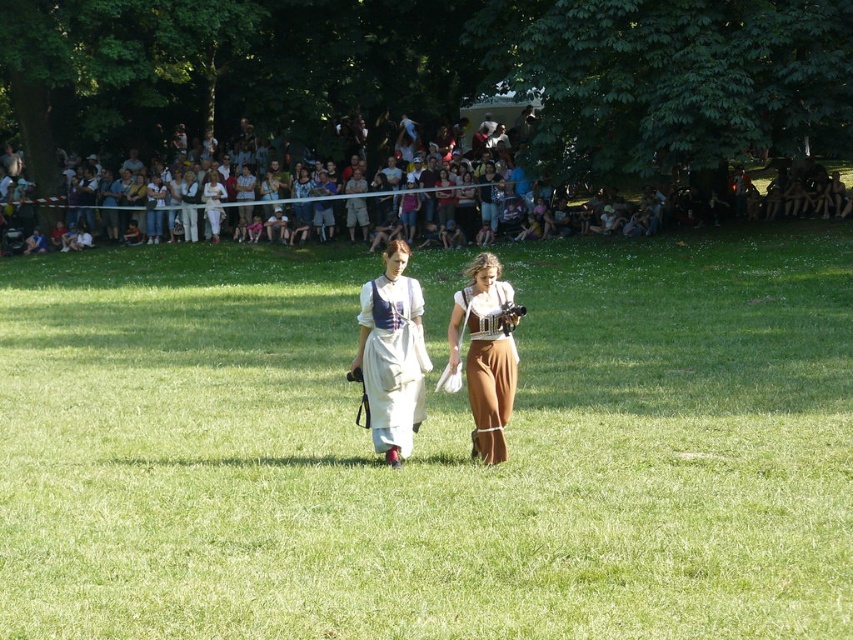
Question: Does white casual clothing at upper center appear over matte white dress at center?

Choices:
 (A) no
 (B) yes

Answer: (B)

Question: Which point appears farthest from the camera in this image?

Choices:
 (A) (482, 396)
 (B) (683, 349)
 (C) (399, 284)

Answer: (B)

Question: Estimate the real-world distances between objects in this image. Which object is farther from the brown leather pants at center?

Choices:
 (A) green grass at center
 (B) white casual clothing at upper center
 (C) matte white dress at center

Answer: (B)

Question: Can you confirm if green grass at center is positioned to the left of white casual clothing at upper center?

Choices:
 (A) no
 (B) yes

Answer: (A)

Question: Which of these objects is positioned farthest from the white casual clothing at upper center?

Choices:
 (A) green grass at center
 (B) brown leather pants at center

Answer: (B)

Question: Does green grass at center appear under matte white dress at center?

Choices:
 (A) no
 (B) yes

Answer: (B)